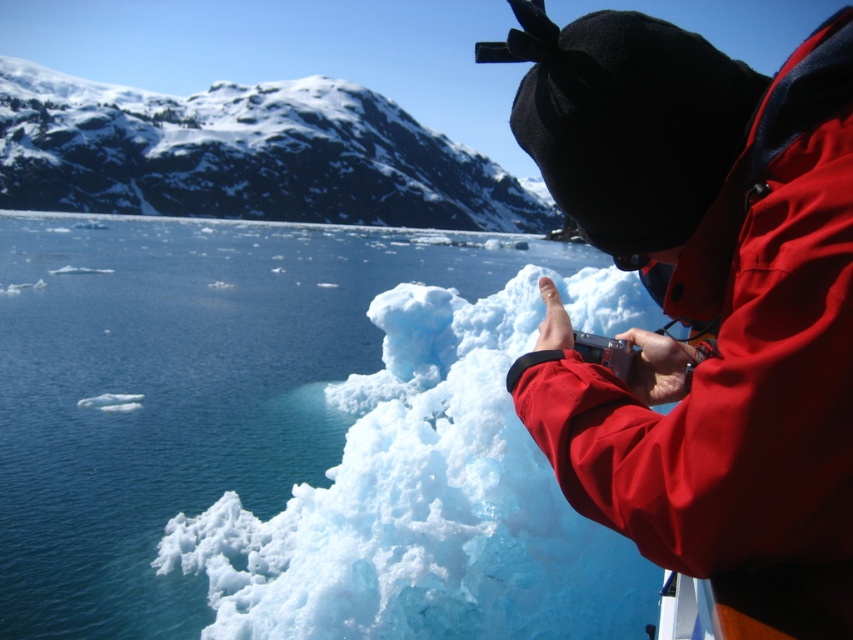
You are a photographer trying to capture the white ice at upper left and the transparent blue water at center in your shot. Based on their heights, which one will appear larger in the photo?

The white ice at upper left will appear larger in the photo because it is taller than the transparent blue water at center.

You are planning to cross from the white ice at upper left to the transparent blue water at center. Based on the scene, which one is narrower and could be a challenge for your crossing?

The transparent blue water at center is narrower than the white ice at upper left, so crossing it might be more challenging due to its reduced width.